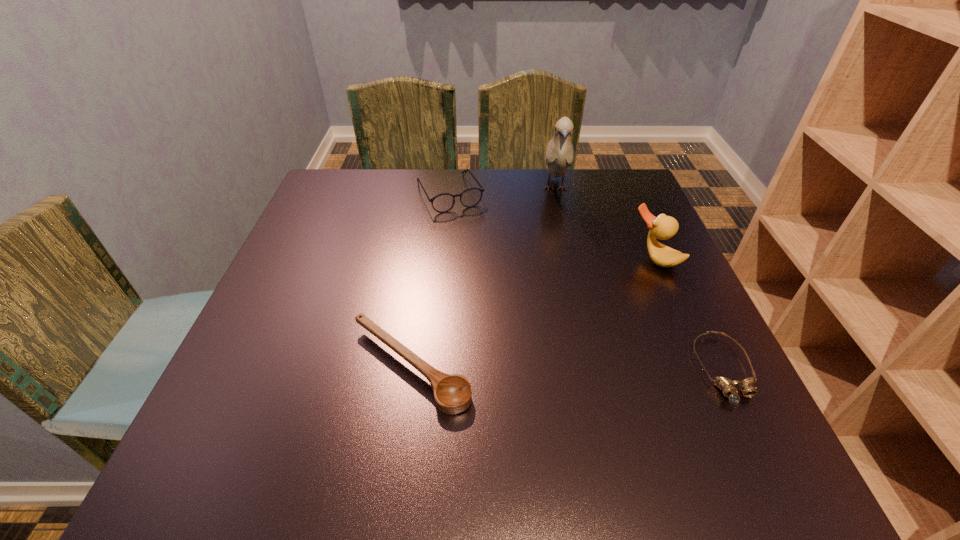
Choose which object is the nearest neighbor to the fourth shortest object. Please provide its 2D coordinates. Your answer should be formatted as a tuple, i.e. [(x, y)], where the tuple contains the x and y coordinates of a point satisfying the conditions above.

[(728, 387)]

Locate an element on the screen. vacant space that satisfies the following two spatial constraints: 1. on the back side of the wooden spoon; 2. on the left side of the tallest object is located at coordinates (435, 188).